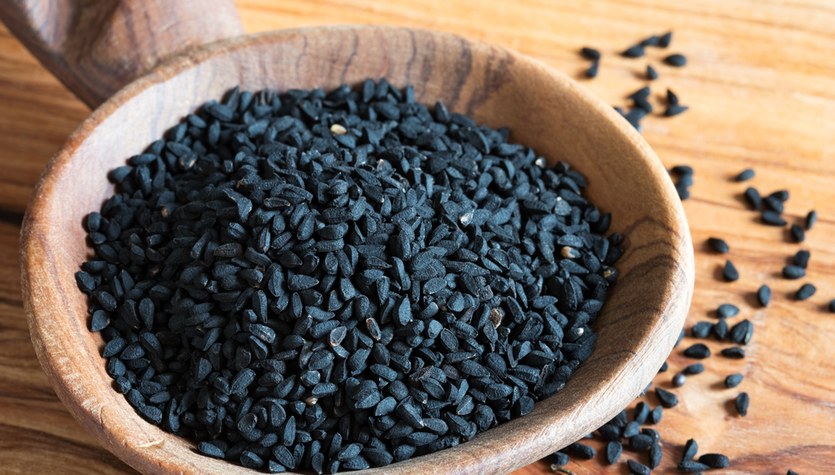
Where is `tabletop`? The width and height of the screenshot is (835, 475). tabletop is located at coordinates (751, 81).